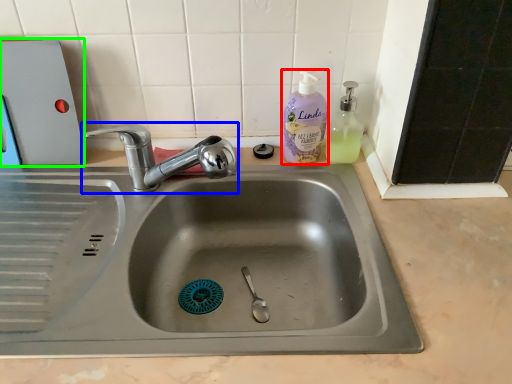
Question: Which is nearer to the cleaning product (highlighted by a red box)? tap (highlighted by a blue box) or appliance (highlighted by a green box).

Choices:
 (A) tap
 (B) appliance

Answer: (A)